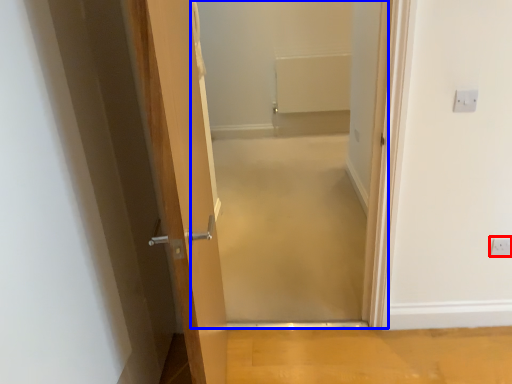
Question: Which of the following is the closest to the observer, electric outlet (highlighted by a red box) or corridor (highlighted by a blue box)?

Choices:
 (A) electric outlet
 (B) corridor

Answer: (B)